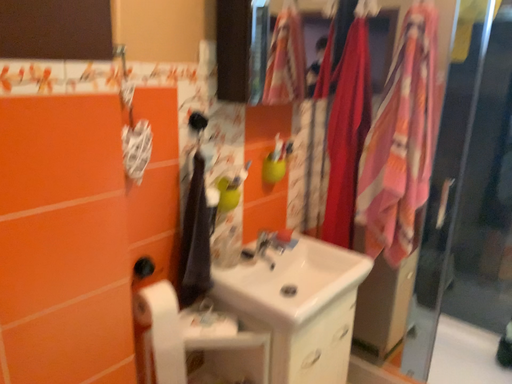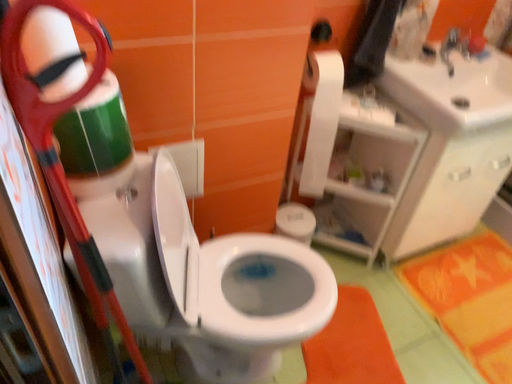
Question: How did the camera likely rotate when shooting the video?

Choices:
 (A) rotated downward
 (B) rotated upward

Answer: (A)